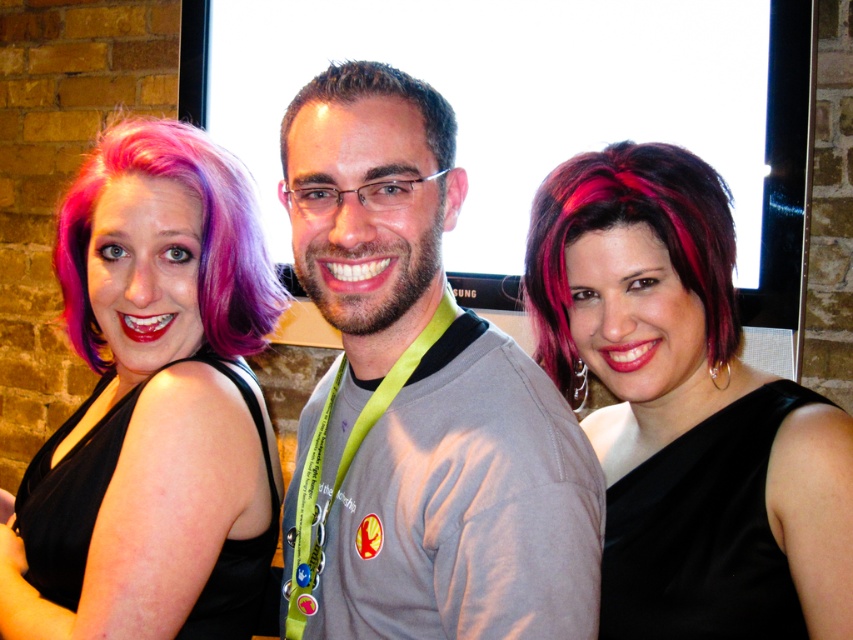
You are standing in front of the group photo. There are two points marked on the image at coordinates point (675, 198) and point (67, 264). Which point is closer to you?

Point (675, 198) is closer to the viewer than point (67, 264).

You are a photographer adjusting the camera settings for a portrait. The subjects are wearing a shiny black dress at center and have shiny dark red hair at center. Which of the two should you focus on first to ensure proper exposure, considering their height difference?

The shiny black dress at center has a greater height compared to the shiny dark red hair at center, so you should focus on the shiny black dress at center first since it is taller and might occupy more of the frame.